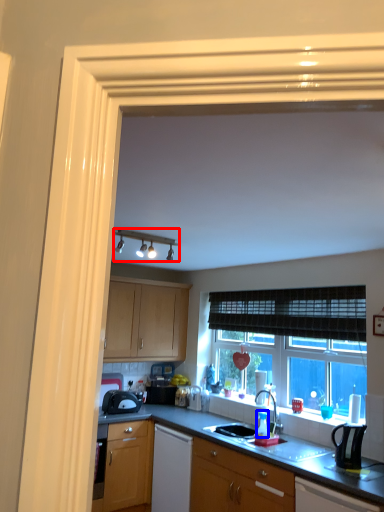
Question: Which object is further to the camera taking this photo, light fixture (highlighted by a red box) or bottle (highlighted by a blue box)?

Choices:
 (A) light fixture
 (B) bottle

Answer: (B)